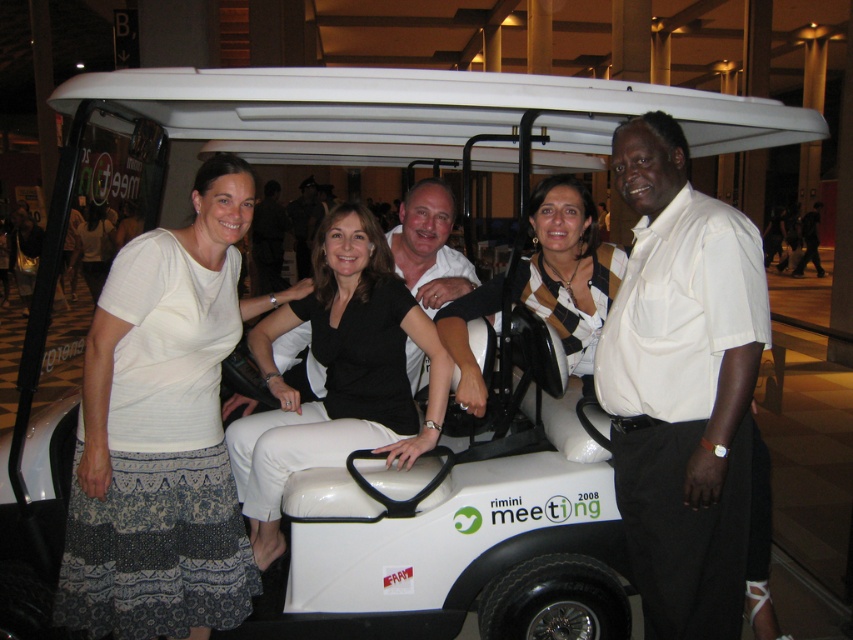
You are a photographer trying to adjust the composition of the image. You notice the white textured skirt at lower left and the black matte pants at center. Which object is covering part of the other?

The white textured skirt at lower left is positioned over the black matte pants at center, so it is covering part of the black matte pants at center.

Looking at this image, you are a photographer trying to adjust the composition of this group photo. You want to ensure that the white textured skirt at lower left and the black matte pants at center are both clearly visible. Based on their current positions, which one is closer to the camera?

The white textured skirt at lower left is in front of the black matte pants at center, so it is closer to the camera and will be more visible.